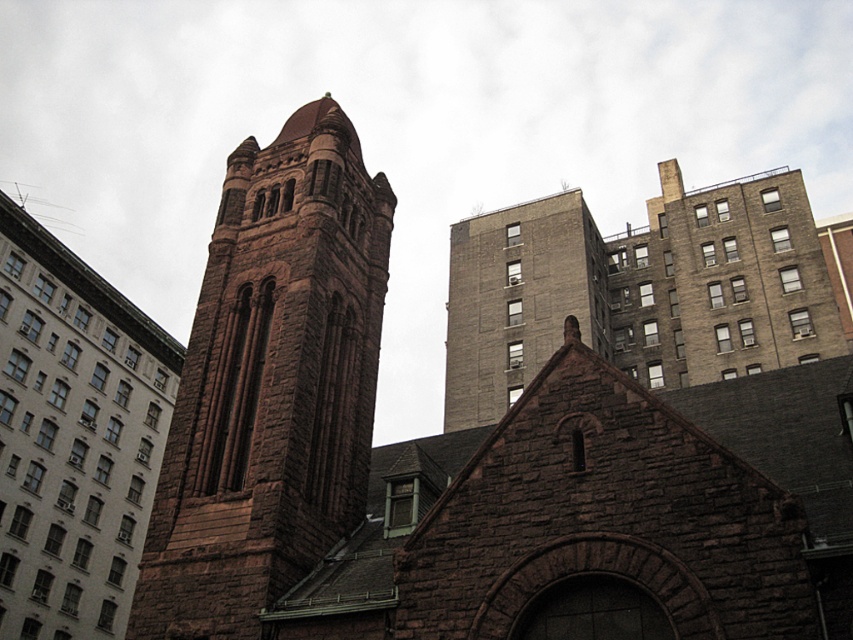
Question: Can you confirm if brown stone church at left is positioned below brown stone building at upper center?

Choices:
 (A) yes
 (B) no

Answer: (A)

Question: Does brown stone church at left appear on the left side of brown stone building at upper center?

Choices:
 (A) yes
 (B) no

Answer: (A)

Question: Which of the following is the closest to the observer?

Choices:
 (A) brown stone church at center
 (B) brown stone church at left

Answer: (A)

Question: Observing the image, what is the correct spatial positioning of brown stone tower at center in reference to brown stone building at upper center?

Choices:
 (A) left
 (B) right

Answer: (A)

Question: Which point appears closest to the camera in this image?

Choices:
 (A) (491, 246)
 (B) (839, 548)
 (C) (212, 412)

Answer: (B)

Question: Which point is closer to the camera?

Choices:
 (A) (49, 628)
 (B) (463, 358)

Answer: (A)